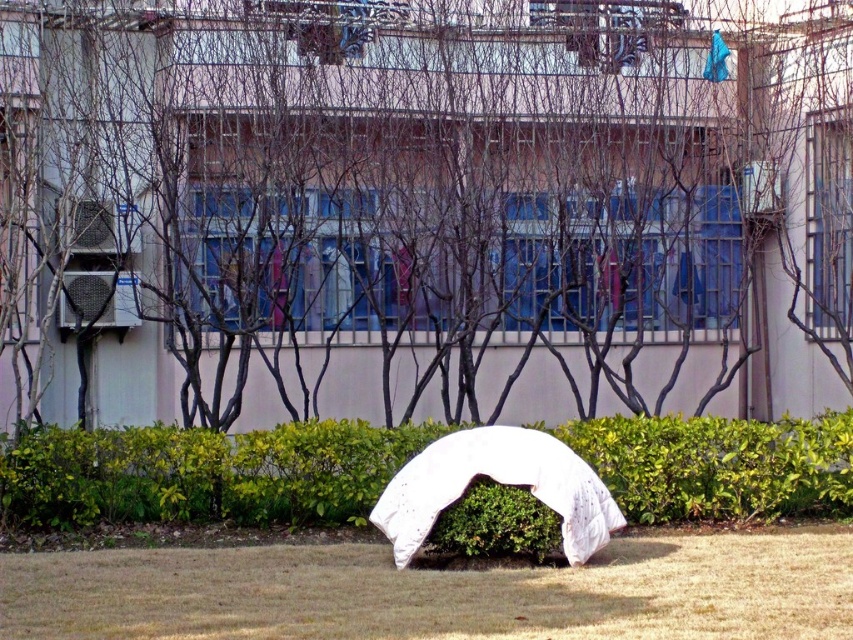
Question: Is white fabric umbrella at center wider than green leafy bush at center?

Choices:
 (A) no
 (B) yes

Answer: (A)

Question: Which of these objects is positioned farthest from the green leafy bush at center?

Choices:
 (A) white quilted blanket at center
 (B) white fabric umbrella at center

Answer: (B)

Question: Which point is farther to the camera?

Choices:
 (A) (582, 524)
 (B) (666, 22)

Answer: (B)

Question: Is white fabric umbrella at center above green leafy bush at center?

Choices:
 (A) yes
 (B) no

Answer: (A)

Question: Estimate the real-world distances between objects in this image. Which object is closer to the white quilted blanket at center?

Choices:
 (A) white fabric umbrella at center
 (B) dry grass at center
 (C) green leafy hedge at center
 (D) green leafy bush at center

Answer: (D)

Question: Is the position of dry grass at center more distant than that of white quilted blanket at center?

Choices:
 (A) yes
 (B) no

Answer: (B)